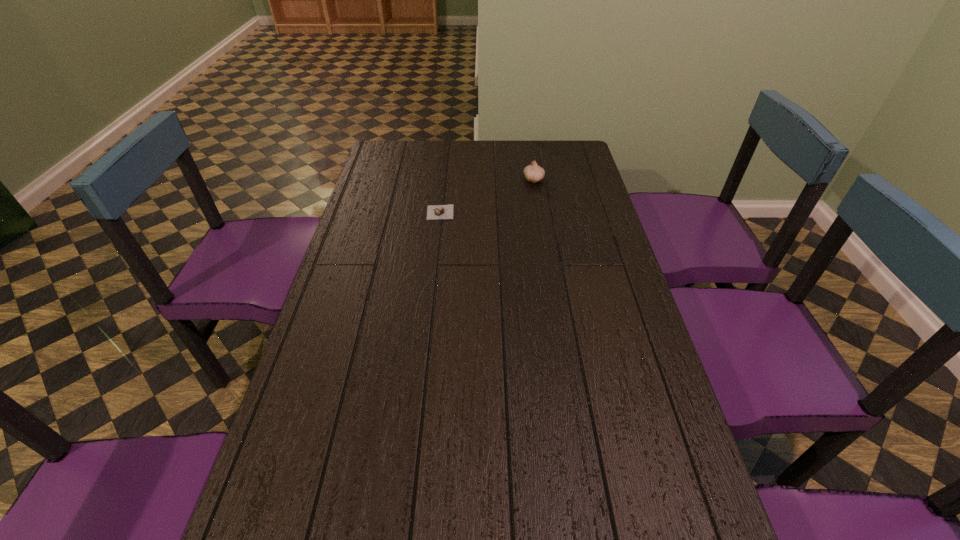
Find the location of a particular element. The height and width of the screenshot is (540, 960). vacant space in between the shorter garlic and the right garlic is located at coordinates (487, 196).

Locate an element on the screen. The width and height of the screenshot is (960, 540). vacant space that is in between the right garlic and the nearer garlic is located at coordinates (487, 196).

Where is `vacant region between the nearer garlic and the farther object`? Image resolution: width=960 pixels, height=540 pixels. vacant region between the nearer garlic and the farther object is located at coordinates (487, 196).

You are a GUI agent. You are given a task and a screenshot of the screen. Output one action in this format:
    pyautogui.click(x=<x>, y=<y>)
    Task: Click on the vacant region between the left garlic and the taller garlic
    
    Given the screenshot: What is the action you would take?
    pyautogui.click(x=487, y=196)

Where is `free spot between the left object and the farther garlic`? This screenshot has height=540, width=960. free spot between the left object and the farther garlic is located at coordinates (487, 196).